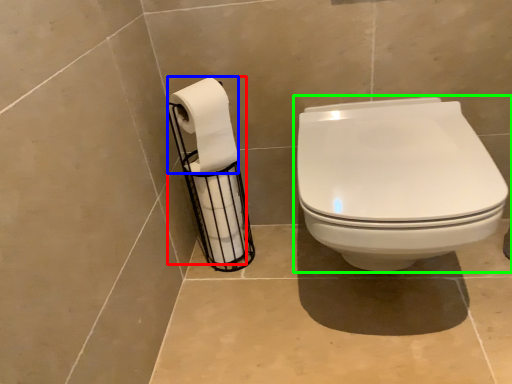
Question: Estimate the real-world distances between objects in this image. Which object is farther from toilet paper (highlighted by a red box), toilet paper (highlighted by a blue box) or toilet (highlighted by a green box)?

Choices:
 (A) toilet paper
 (B) toilet

Answer: (B)